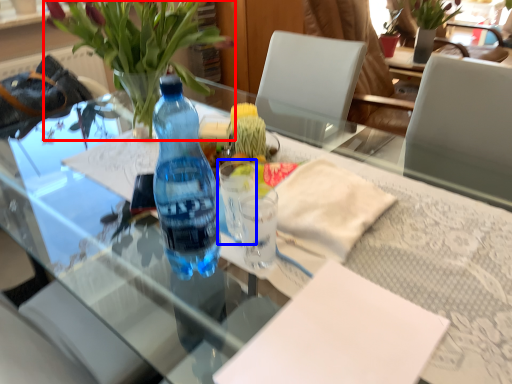
Question: Among these objects, which one is nearest to the camera, houseplant (highlighted by a red box) or coffee cup (highlighted by a blue box)?

Choices:
 (A) houseplant
 (B) coffee cup

Answer: (A)